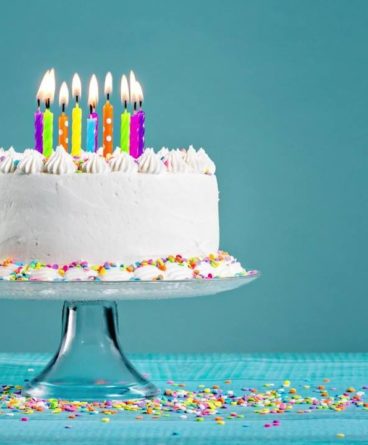
Locate an element on the screen. Image resolution: width=368 pixels, height=445 pixels. flames on candles is located at coordinates (41, 90), (47, 89), (64, 94), (77, 88), (90, 98), (94, 78), (106, 79), (124, 86), (132, 90), (140, 93).